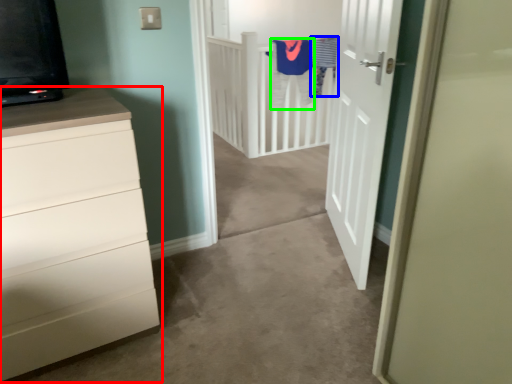
Question: Based on their relative distances, which object is nearer to chest of drawers (highlighted by a red box)? Choose from laundry (highlighted by a blue box) and robe (highlighted by a green box).

Choices:
 (A) laundry
 (B) robe

Answer: (B)